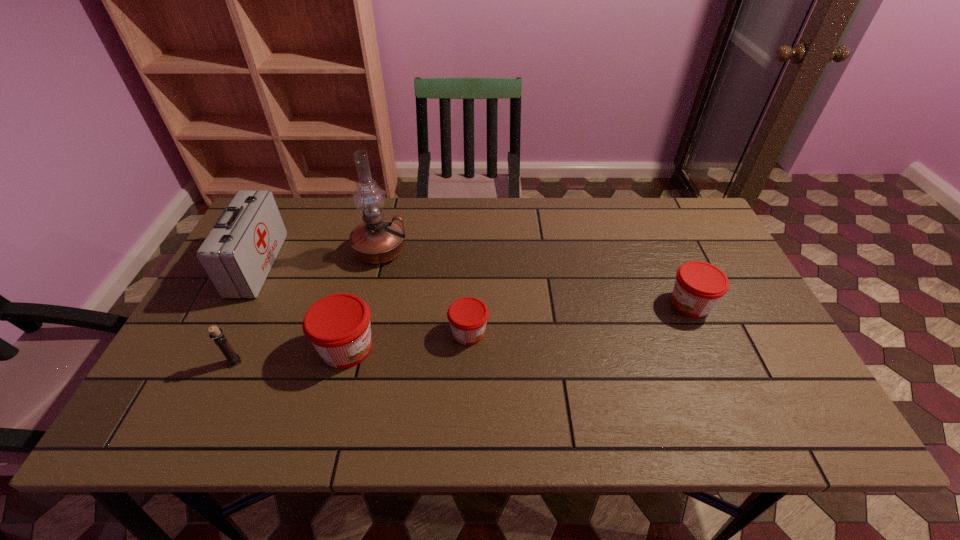
Where is `vacant point at the far left corner`? This screenshot has height=540, width=960. vacant point at the far left corner is located at coordinates (300, 234).

I want to click on free location at the far right corner of the desktop, so click(683, 202).

Identify the location of empty location between the second tallest jam and the leftmost object. (474, 284).

Identify the location of empty location between the fifth object from right to left and the tallest jam. The width and height of the screenshot is (960, 540). [291, 355].

Find the location of a particular element. vacant space that is in between the shortest jam and the oil lamp is located at coordinates (424, 292).

Locate an element on the screen. The height and width of the screenshot is (540, 960). free space between the tallest jam and the tallest object is located at coordinates (364, 300).

Find the location of a particular element. Image resolution: width=960 pixels, height=540 pixels. vacant space in between the tallest object and the fifth object from right to left is located at coordinates (308, 306).

Locate an element on the screen. vacant space in between the tallest object and the tallest jam is located at coordinates click(364, 300).

Locate an element on the screen. vacant area that lies between the shortest jam and the tallest object is located at coordinates coord(424,292).

Where is `free space between the leftmost jam and the oil lamp`? free space between the leftmost jam and the oil lamp is located at coordinates (364, 300).